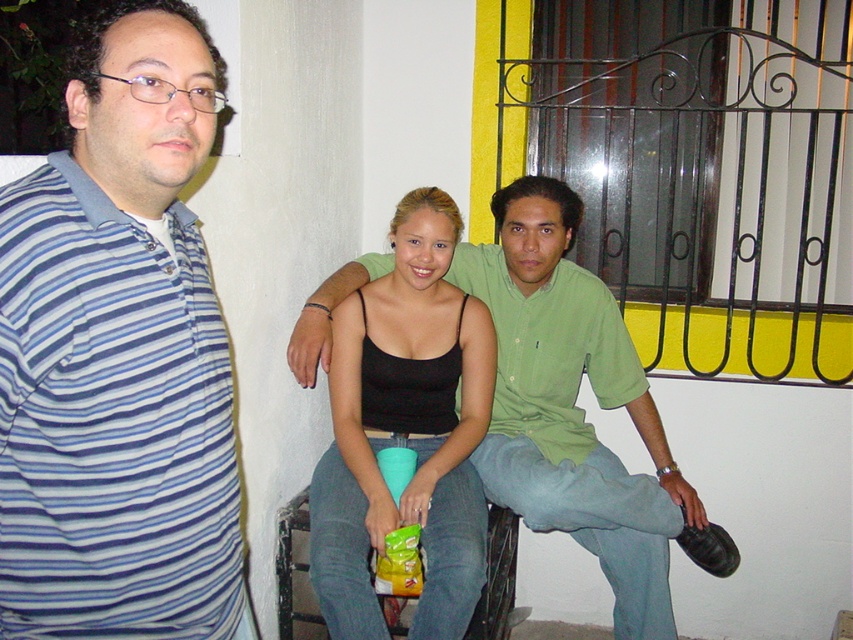
Question: Can you confirm if blue striped shirt at left is thinner than green cotton shirt at center?

Choices:
 (A) no
 (B) yes

Answer: (B)

Question: Among these points, which one is farthest from the camera?

Choices:
 (A) (440, 304)
 (B) (604, 320)
 (C) (9, 369)

Answer: (B)

Question: Is green cotton shirt at center above black matte tank top at center?

Choices:
 (A) no
 (B) yes

Answer: (A)

Question: Which is farther from the blue striped shirt at left?

Choices:
 (A) green cotton shirt at center
 (B) black matte tank top at center

Answer: (A)

Question: Considering the relative positions of blue striped shirt at left and green cotton shirt at center in the image provided, where is blue striped shirt at left located with respect to green cotton shirt at center?

Choices:
 (A) below
 (B) above

Answer: (B)

Question: Which object is farther from the camera taking this photo?

Choices:
 (A) green cotton shirt at center
 (B) blue striped shirt at left
 (C) black matte tank top at center

Answer: (A)